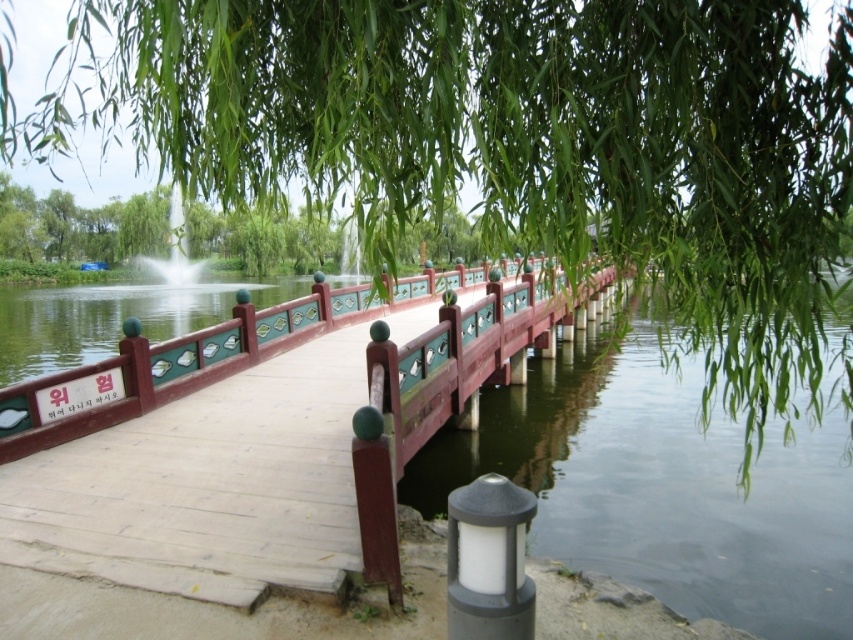
You are a painter setting up your easel in the park. You want to paint the polished wood railing at center and the matte gray lamp post at lower center. Which object should you focus on first if you want to paint the larger object first?

The polished wood railing at center is larger in size than the matte gray lamp post at lower center, so you should focus on painting the polished wood railing at center first.